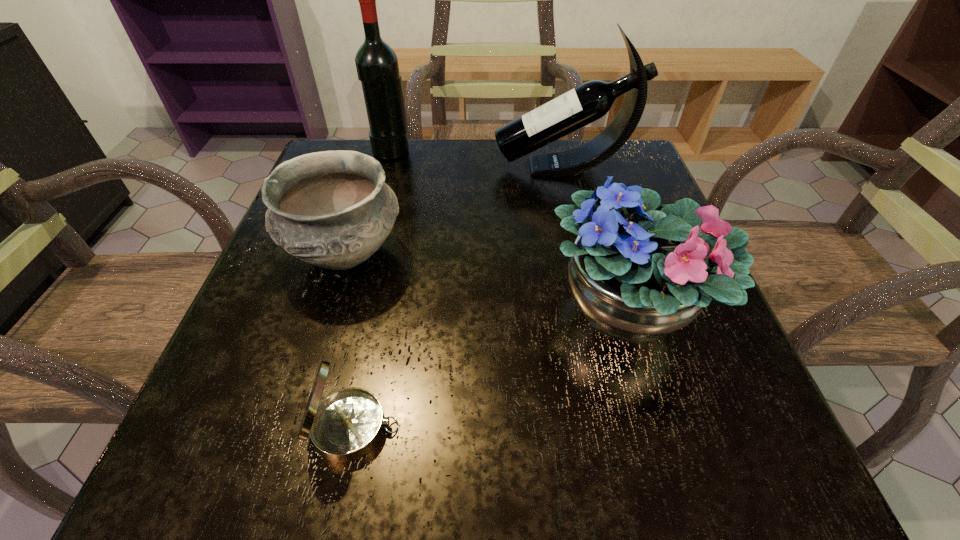
This screenshot has width=960, height=540. I want to click on free space between the second shortest object and the nearest object, so click(350, 341).

Locate an element on the screen. Image resolution: width=960 pixels, height=540 pixels. free space between the bouquet and the nearest object is located at coordinates (492, 368).

You are a GUI agent. You are given a task and a screenshot of the screen. Output one action in this format:
    pyautogui.click(x=<x>, y=<y>)
    Task: Click on the free space between the bouquet and the left wine bottle
    This screenshot has height=540, width=960.
    Given the screenshot: What is the action you would take?
    pyautogui.click(x=511, y=229)

The width and height of the screenshot is (960, 540). I want to click on vacant area that lies between the fourth shortest object and the left wine bottle, so click(x=477, y=159).

Locate an element on the screen. This screenshot has width=960, height=540. vacant area that lies between the left wine bottle and the right wine bottle is located at coordinates (477, 159).

Where is `free point between the left wine bottle and the nearest object`? Image resolution: width=960 pixels, height=540 pixels. free point between the left wine bottle and the nearest object is located at coordinates (372, 288).

You are a GUI agent. You are given a task and a screenshot of the screen. Output one action in this format:
    pyautogui.click(x=<x>, y=<y>)
    Task: Click on the empty space that is in between the bouquet and the nearest object
    The height and width of the screenshot is (540, 960).
    Given the screenshot: What is the action you would take?
    pyautogui.click(x=492, y=368)

This screenshot has width=960, height=540. What are the coordinates of `free spot between the pottery and the bouquet` in the screenshot? It's located at (488, 281).

This screenshot has height=540, width=960. What are the coordinates of `unoccupied area between the pottery and the shortest object` in the screenshot? It's located at (350, 341).

Locate an element on the screen. This screenshot has width=960, height=540. the second closest object relative to the shortest object is located at coordinates (639, 271).